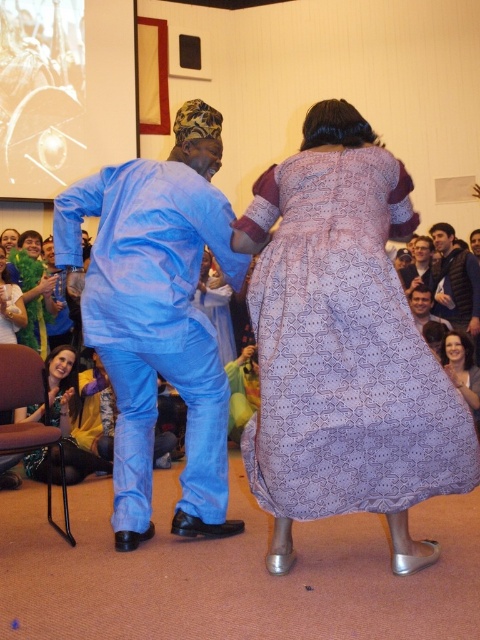
Does point (282, 490) come in front of point (429, 248)?

Yes, it is.

How far apart are purple textured dress at center and matte blue suit at center?

purple textured dress at center and matte blue suit at center are 3.29 meters apart.

Who is more forward, (352,218) or (419,246)?

Point (352,218)

In order to click on purple textured dress at center in this screenshot , I will do `click(344, 348)`.

Which is above, yellow fabric at lower left or smooth skin face at center?

smooth skin face at center is above.

Is yellow fabric at lower left positioned in front of smooth skin face at center?

Yes.

Is point (67, 444) more distant than point (417, 316)?

That is False.

The width and height of the screenshot is (480, 640). In order to click on yellow fabric at lower left in this screenshot , I will do `click(69, 413)`.

Image resolution: width=480 pixels, height=640 pixels. Find the location of `purple textured dress at center`. purple textured dress at center is located at coordinates (344, 348).

Can you confirm if purple textured dress at center is positioned below dark blue vest at upper right?

Yes, purple textured dress at center is below dark blue vest at upper right.

Does point (303, 248) come behind point (454, 324)?

No.

At what (x,y) coordinates should I click in order to perform the action: click on purple textured dress at center. Please return your answer as a coordinate pair (x, y). The width and height of the screenshot is (480, 640). Looking at the image, I should click on (344, 348).